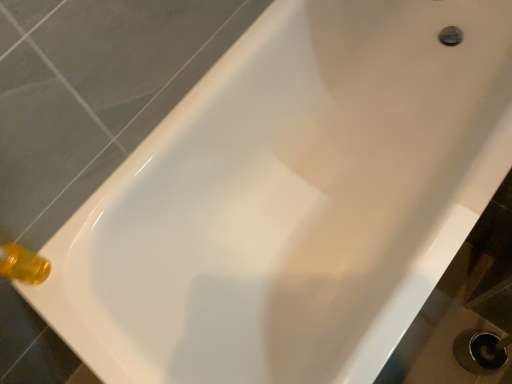
Where is `free location in front of translucent yellow liquid at lower left`? The width and height of the screenshot is (512, 384). free location in front of translucent yellow liquid at lower left is located at coordinates (71, 317).